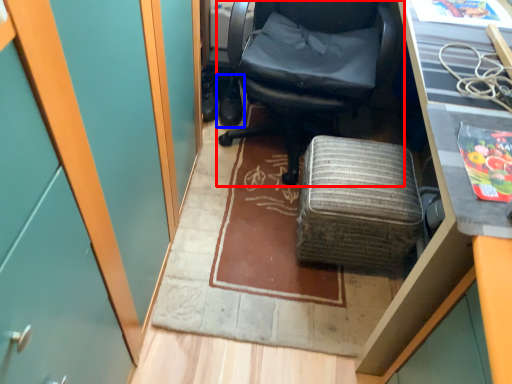
Question: Which object is closer to the camera taking this photo, chair (highlighted by a red box) or footwear (highlighted by a blue box)?

Choices:
 (A) chair
 (B) footwear

Answer: (A)